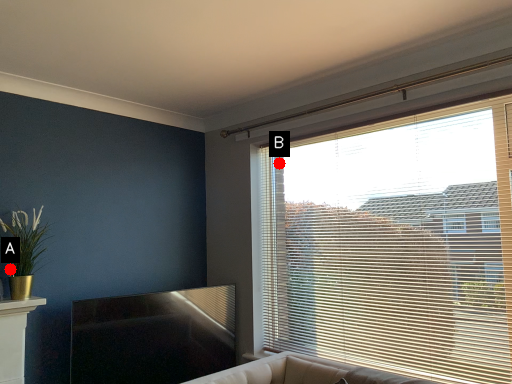
Question: Two points are circled on the image, labeled by A and B beside each circle. Which point is farther to the camera?

Choices:
 (A) A is further
 (B) B is further

Answer: (B)